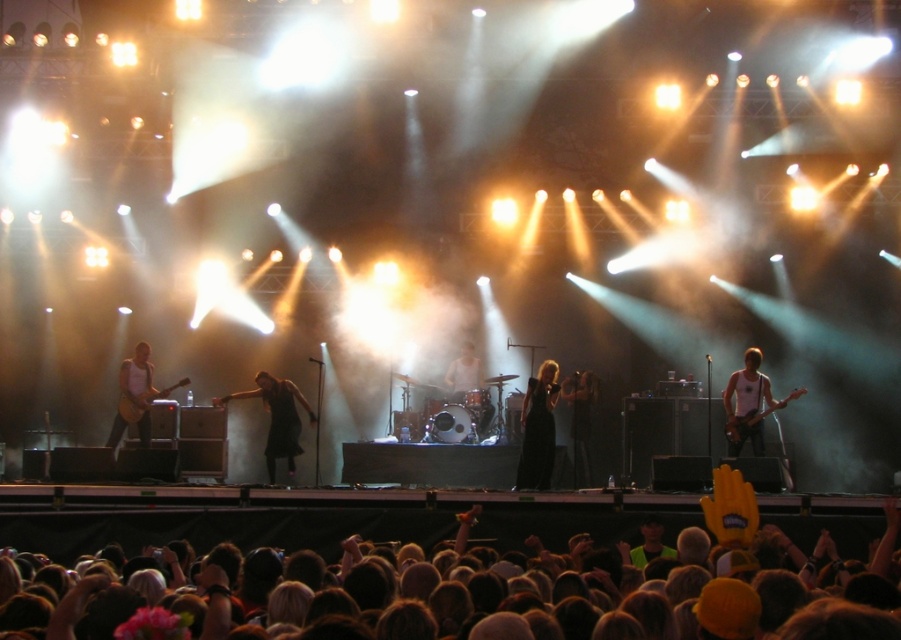
Question: Can you confirm if black velvet dress at center is wider than black leather jacket at center?

Choices:
 (A) no
 (B) yes

Answer: (A)

Question: Which object is the closest to the matte black guitar at left?

Choices:
 (A) black leather jacket at center
 (B) dark brown hair at lower center
 (C) black velvet dress at center
 (D) matte white tank top at left

Answer: (D)

Question: Is dark brown hair at lower center to the right of white matte drum set at center from the viewer's perspective?

Choices:
 (A) no
 (B) yes

Answer: (A)

Question: Which object appears farthest from the camera in this image?

Choices:
 (A) black velvet dress at center
 (B) matte black guitar at left
 (C) black leather jacket at center
 (D) white matte drum set at center

Answer: (D)

Question: Which of the following is the closest to the observer?

Choices:
 (A) black matte dress at center
 (B) white matte tank top at right
 (C) black leather jacket at center

Answer: (B)

Question: Is black velvet dress at center above matte black guitar at left?

Choices:
 (A) yes
 (B) no

Answer: (B)